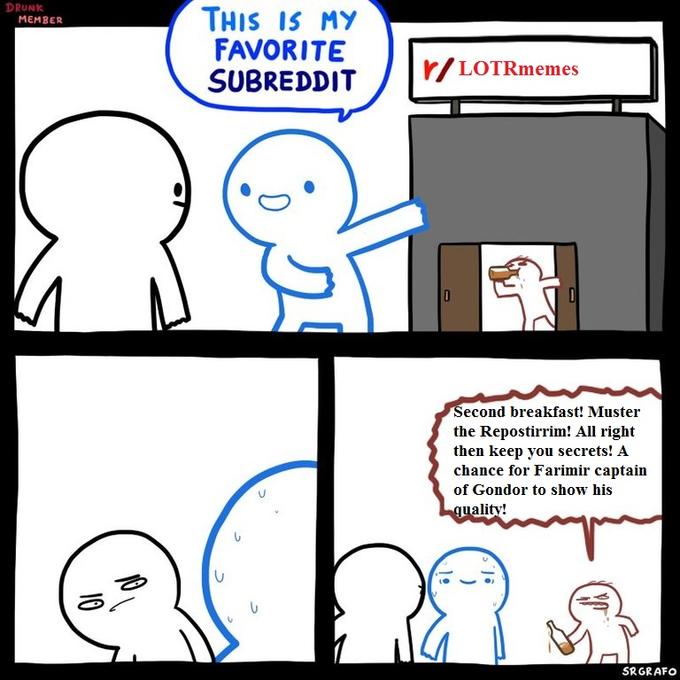
Where is `doors`? This screenshot has width=680, height=680. doors is located at coordinates (454, 319), (568, 313).